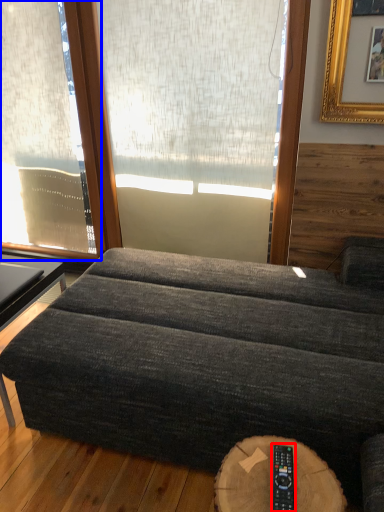
Question: Which of the following is the farthest to the observer, remote (highlighted by a red box) or window (highlighted by a blue box)?

Choices:
 (A) remote
 (B) window

Answer: (B)